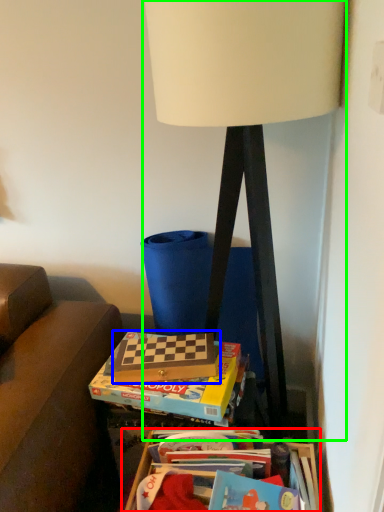
Question: Estimate the real-world distances between objects in this image. Which object is farther from table (highlighted by a red box), paperback book (highlighted by a blue box) or lamp (highlighted by a green box)?

Choices:
 (A) paperback book
 (B) lamp

Answer: (B)